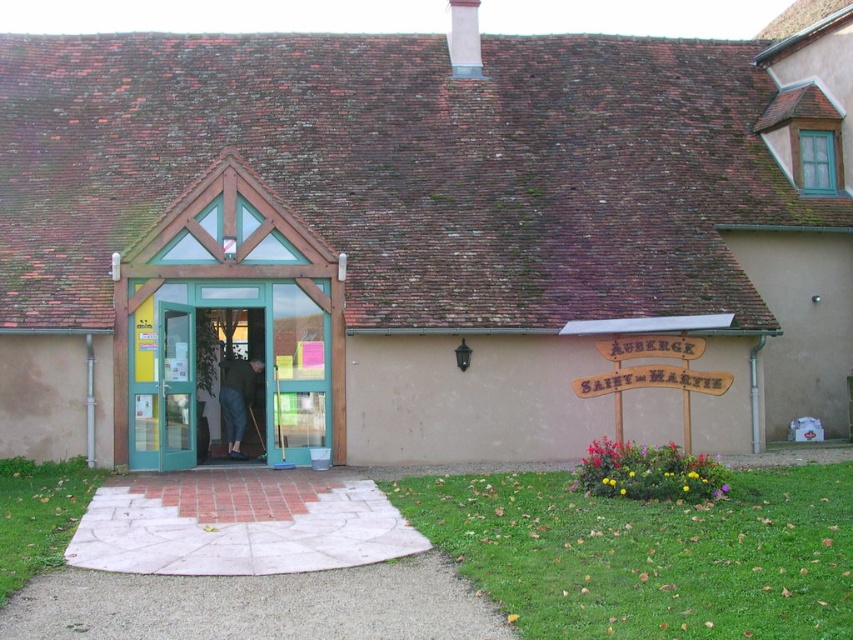
You are standing at the entrance of the building and want to locate the transparent glass door at center. According to the coordinates provided, where exactly is it positioned?

The transparent glass door at center is positioned at the 2D coordinates point [175,387].

From the picture: You are a delivery person standing at the entrance of the building. You need to place a package on the ground near the green glass door at center and dark blue jeans at center. How far apart should you place them?

The green glass door at center is 4.50 feet away from dark blue jeans at center. Therefore, you should place the package 4.50 feet apart from each other.